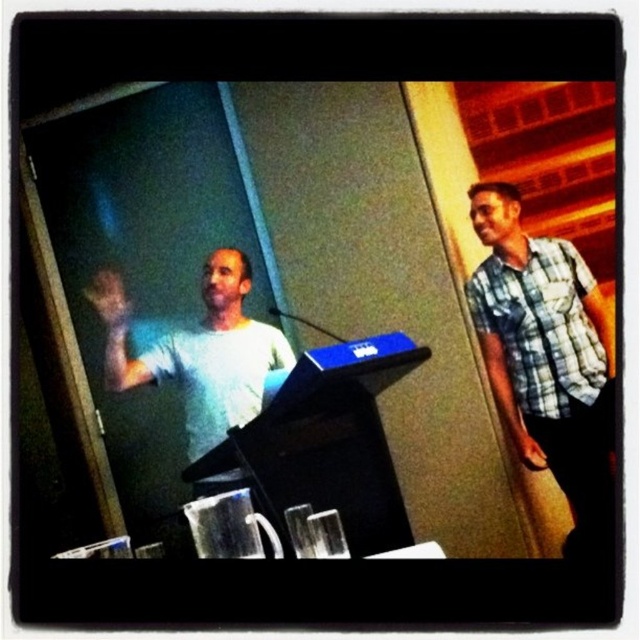
Which is behind, point (515, 246) or point (186, 426)?

Point (515, 246)

Between point (556, 394) and point (104, 323), which one is positioned in front?

Point (556, 394) is in front.

Image resolution: width=640 pixels, height=640 pixels. I want to click on checkered fabric shirt at right, so click(545, 355).